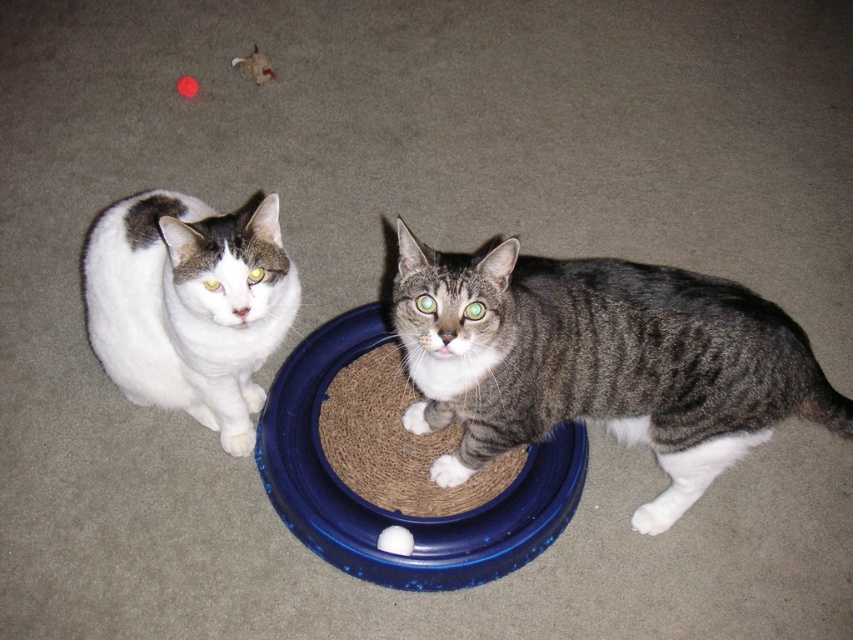
Which is more to the right, gray tabby cat at center or white fur cat at left?

gray tabby cat at center

Does gray tabby cat at center lie behind white fur cat at left?

No, gray tabby cat at center is in front of white fur cat at left.

Is point (529, 417) positioned behind point (258, 227)?

Yes, it is behind point (258, 227).

I want to click on gray tabby cat at center, so click(601, 362).